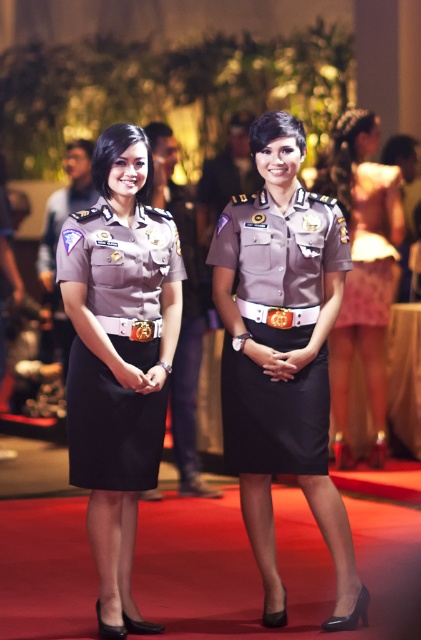
You are a photographer at a formal event and need to position two individuals wearing uniforms for a photo. The scene has two people in the center wearing matte gray uniform at center and matte uniform at center. Which uniform is positioned to the left?

The matte gray uniform at center is positioned to the left of the matte uniform at center.

You are a photographer at a formal event and need to ensure that both the matte gray uniform at center and the silky pink dress at right are visible in the photo. Given their sizes, which one might you need to position closer to the camera to ensure it doesn

The matte gray uniform at center is larger in size than the silky pink dress at right. To ensure both are visible, you should position the silky pink dress at right closer to the camera since it is smaller and might appear too small if farther away.